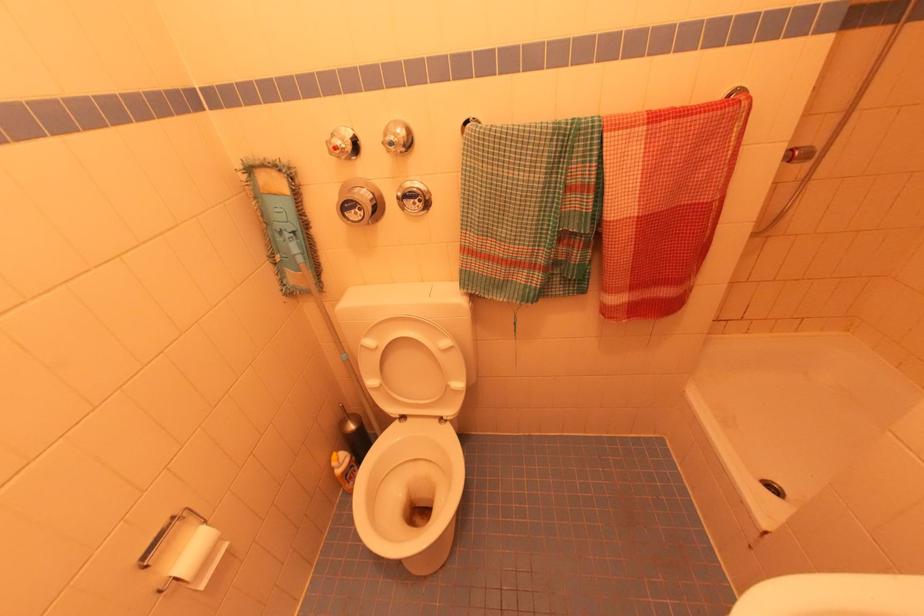
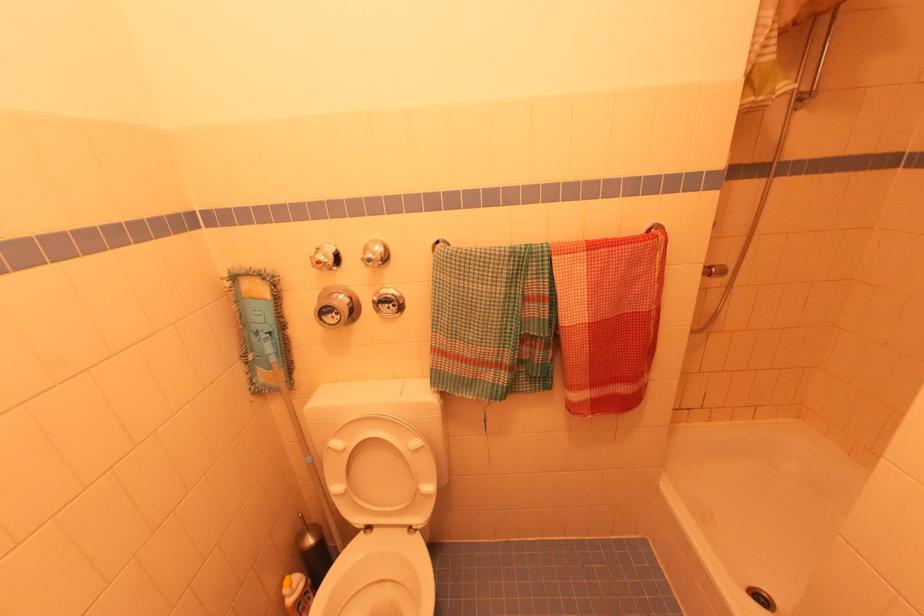
The point at (343, 461) is marked in the first image. Where is the corresponding point in the second image?

(296, 585)